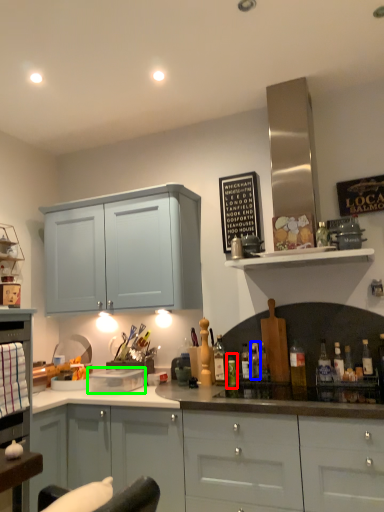
Question: Which is nearer to the bottle (highlighted by a red box)? bottle (highlighted by a blue box) or appliance (highlighted by a green box).

Choices:
 (A) bottle
 (B) appliance

Answer: (A)